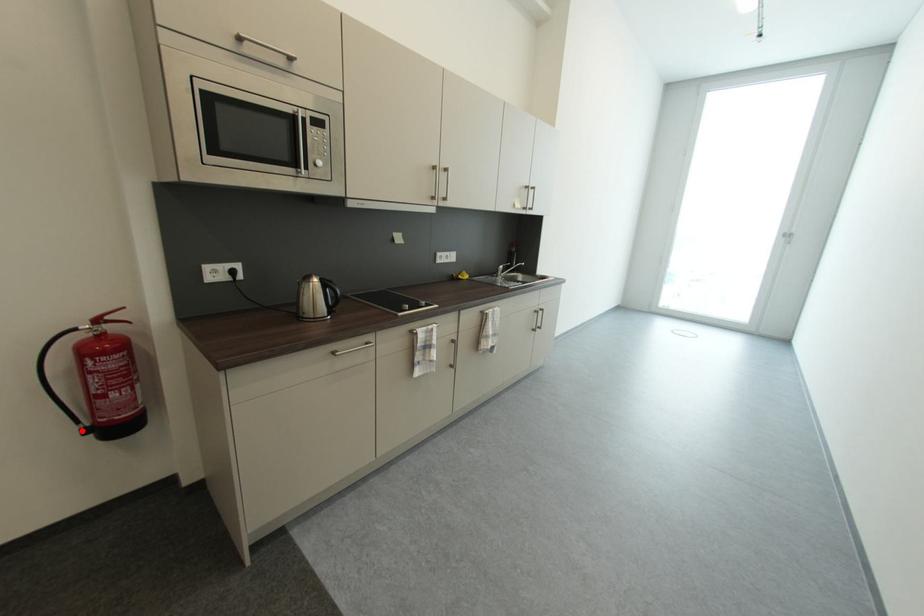
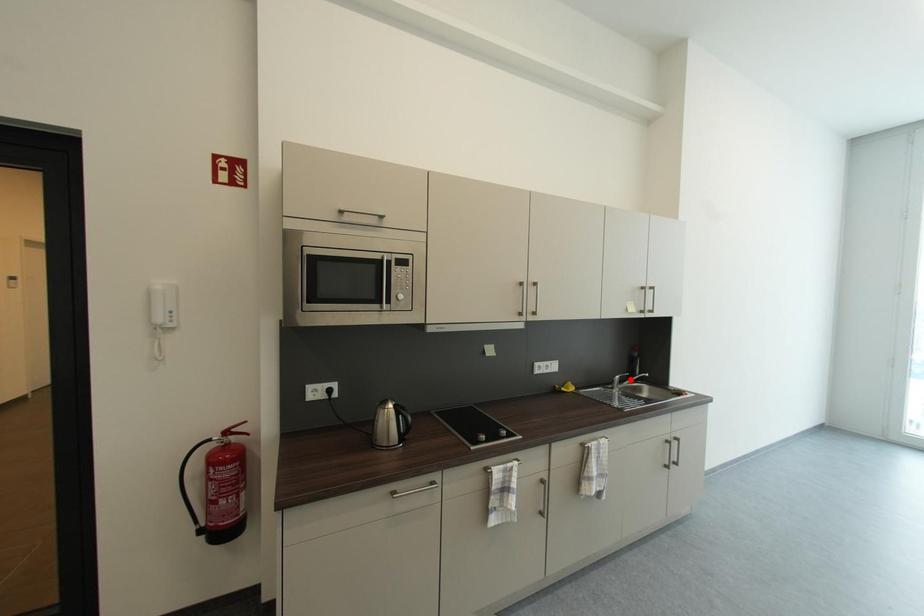
I am providing you with two images of the same scene from different viewpoints. A red point is marked on the first image and another point is marked on the second image. Do the highlighted points in image1 and image2 indicate the same real-world spot?

No